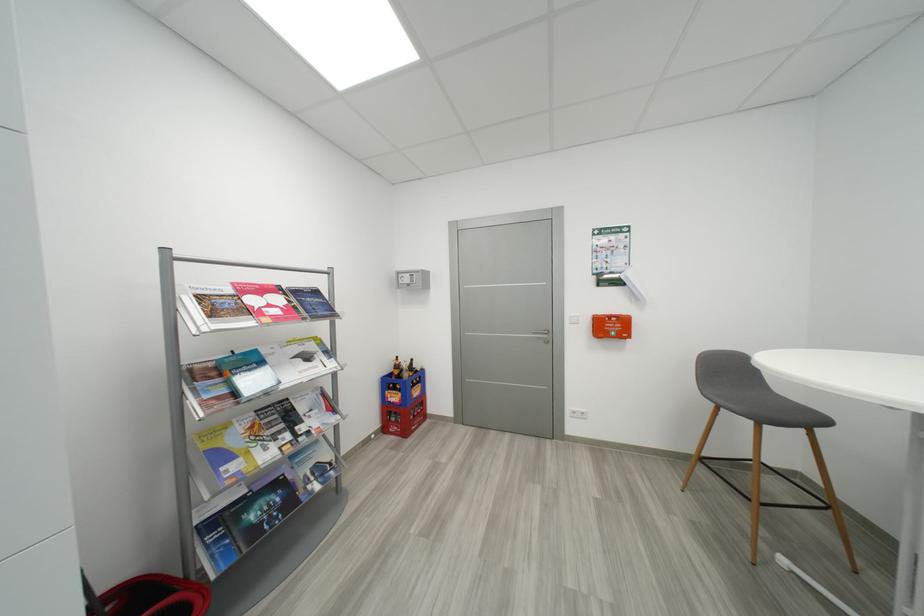
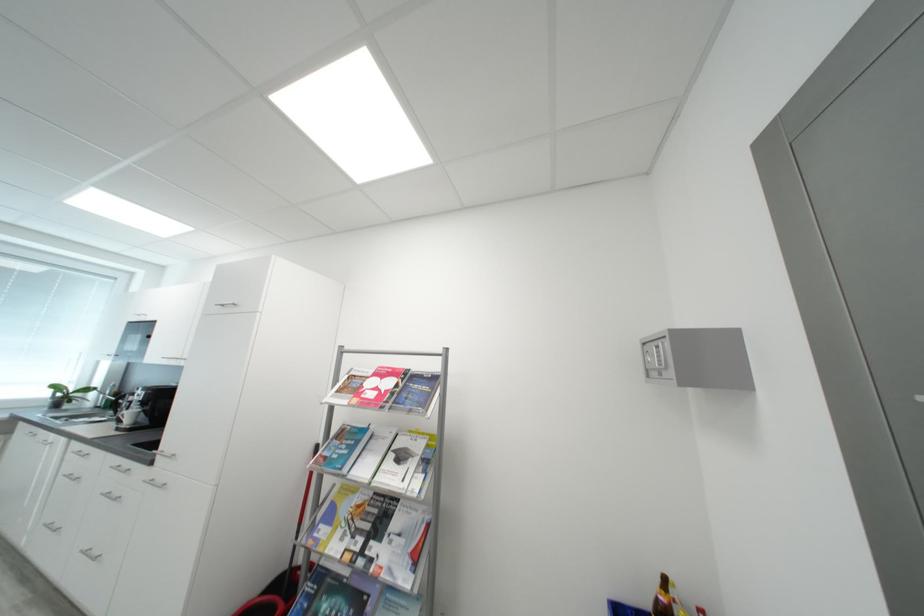
Find the pixel in the second image that matches [412,282] in the first image.

(660, 361)